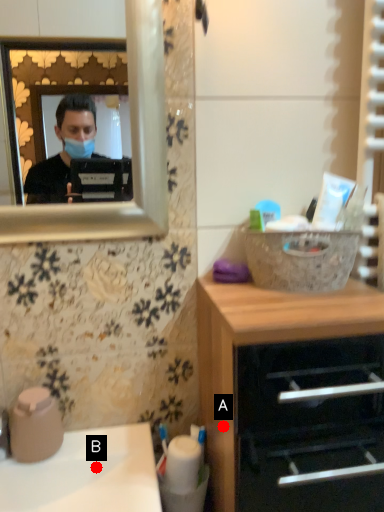
Question: Two points are circled on the image, labeled by A and B beside each circle. Which point is farther from the camera taking this photo?

Choices:
 (A) A is further
 (B) B is further

Answer: (B)